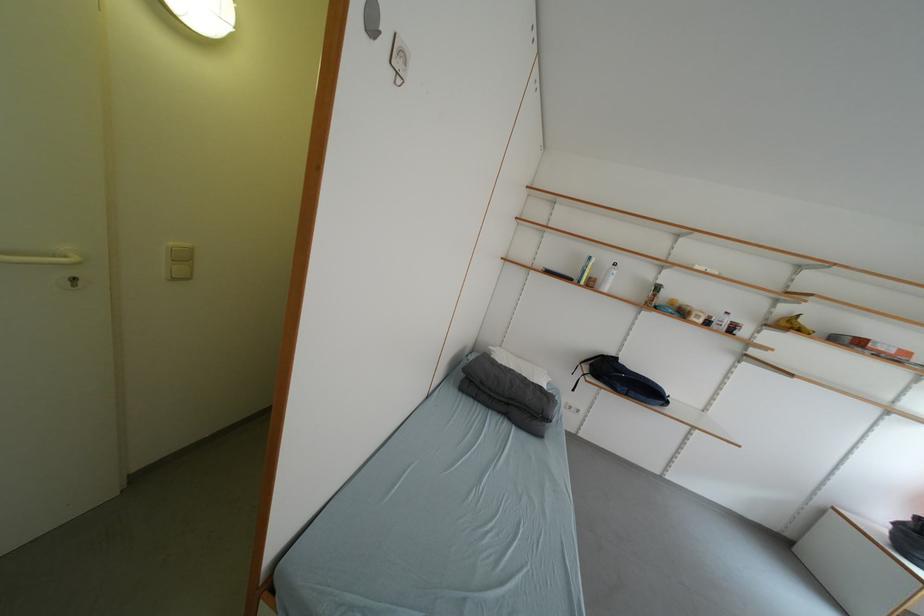
Find where to push the light switch button. Please return your answer as a coordinate pair (x, y).

(179, 262)